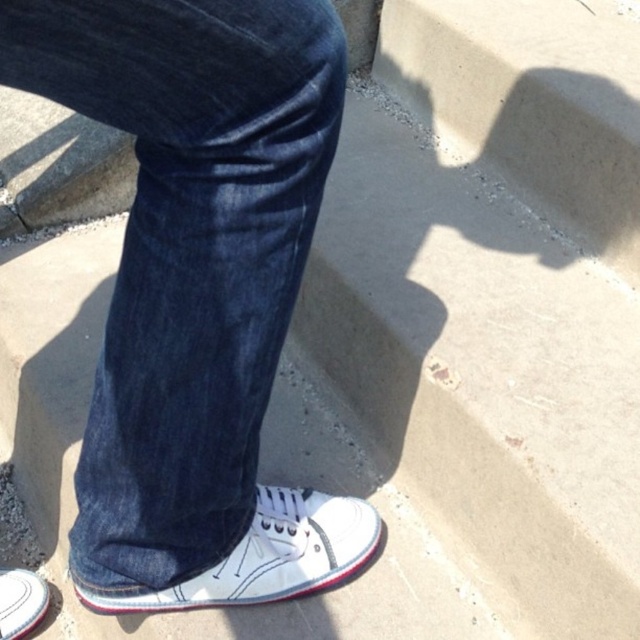
At what (x,y) coordinates should I click in order to perform the action: click on dark blue denim jeans at center. Please return your answer as a coordinate pair (x, y). The width and height of the screenshot is (640, 640). Looking at the image, I should click on (188, 252).

Is dark blue denim jeans at center wider than white canvas shoe at lower center?

No, dark blue denim jeans at center is not wider than white canvas shoe at lower center.

This screenshot has width=640, height=640. Describe the element at coordinates (188, 252) in the screenshot. I see `dark blue denim jeans at center` at that location.

I want to click on dark blue denim jeans at center, so click(188, 252).

The width and height of the screenshot is (640, 640). What do you see at coordinates (188, 252) in the screenshot?
I see `dark blue denim jeans at center` at bounding box center [188, 252].

Between point (168, 225) and point (44, 604), which one is positioned behind?

Positioned behind is point (44, 604).

In order to click on dark blue denim jeans at center in this screenshot , I will do `click(188, 252)`.

Is white canvas shoe at lower center to the right of white canvas shoe at lower left from the viewer's perspective?

Indeed, white canvas shoe at lower center is positioned on the right side of white canvas shoe at lower left.

Does white canvas shoe at lower center have a greater width compared to white canvas shoe at lower left?

Correct, the width of white canvas shoe at lower center exceeds that of white canvas shoe at lower left.

Find the location of a particular element. Image resolution: width=640 pixels, height=640 pixels. white canvas shoe at lower center is located at coordinates (266, 556).